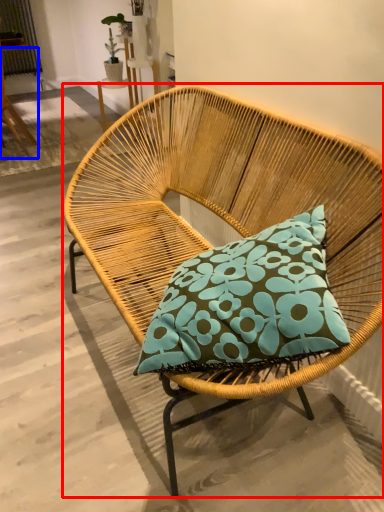
Question: Among these objects, which one is farthest to the camera, chair (highlighted by a red box) or chair (highlighted by a blue box)?

Choices:
 (A) chair
 (B) chair

Answer: (B)